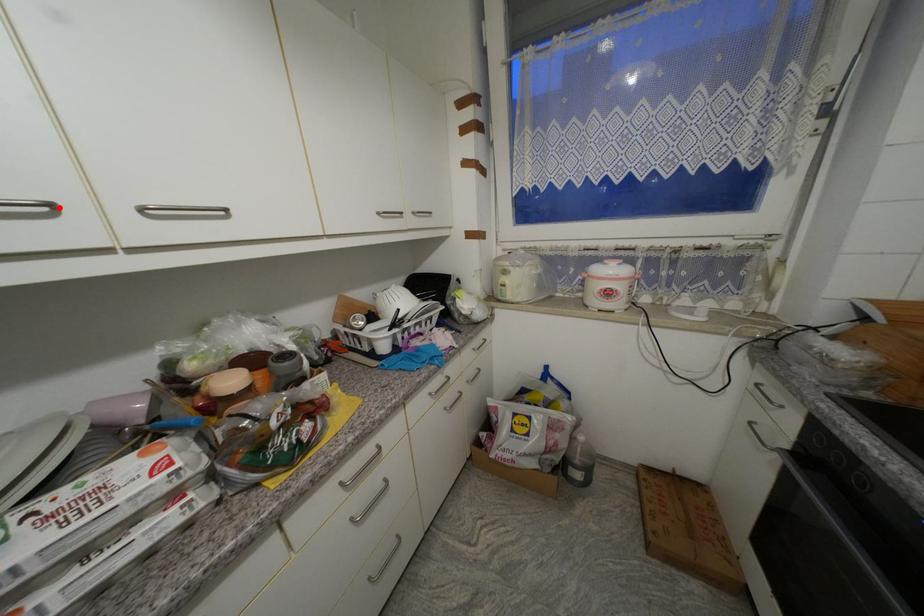
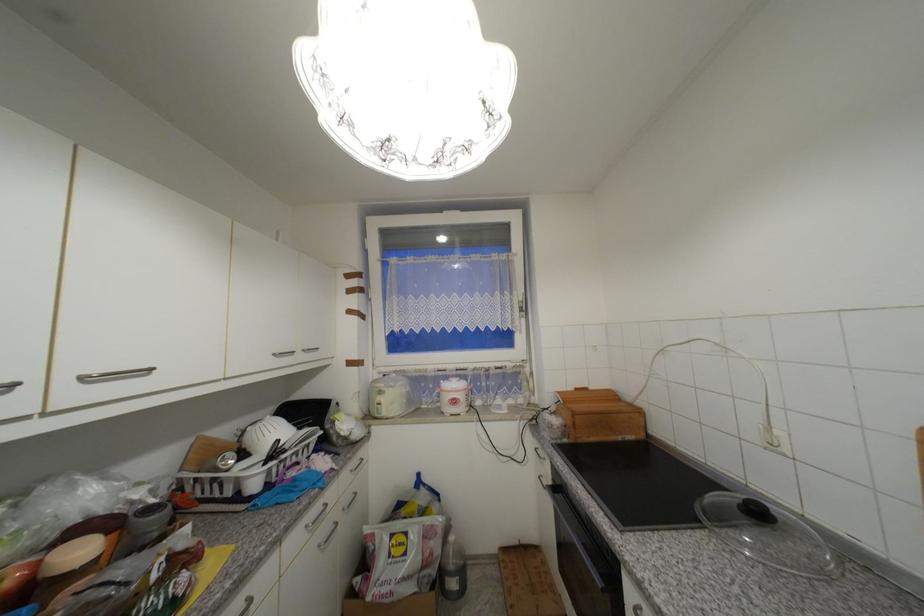
Question: I am providing you with two images of the same scene from different viewpoints. A red point is marked on the first image. Can you still see the location of the red point in image 2?

Choices:
 (A) Yes
 (B) No

Answer: (A)